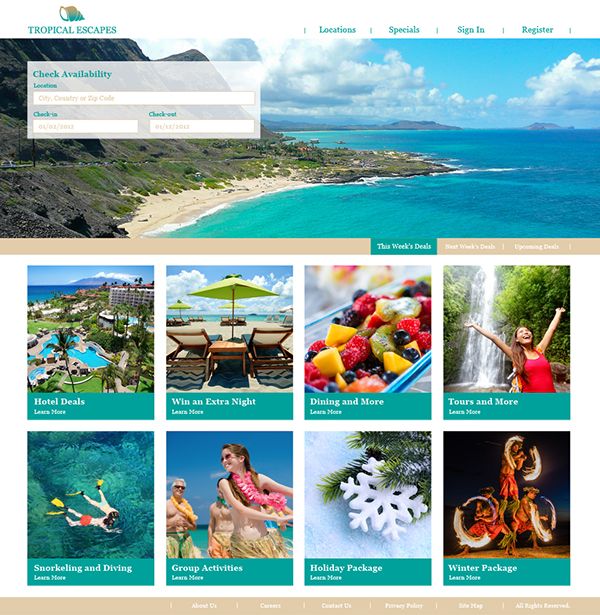
Locate an element on the screen. This screenshot has height=615, width=600. picture of a hotel is located at coordinates (74, 350).